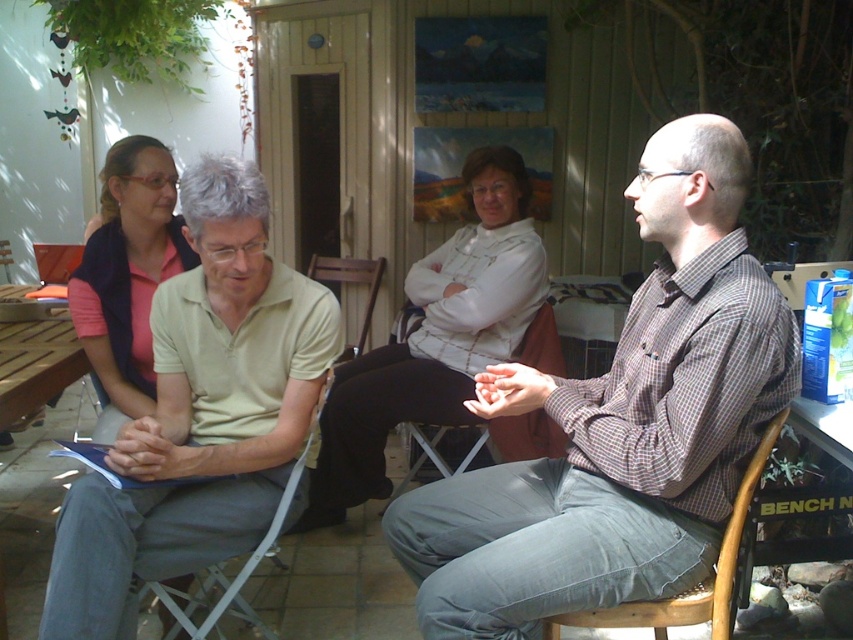
You are a photographer trying to capture a group photo of the two people at the center wearing the checkered fabric shirt at center and the light beige polo shirt at center. Since you want to ensure both are clearly visible, which shirt should you focus on first to avoid blurring due to size differences?

The checkered fabric shirt at center is bigger than the light beige polo shirt at center, so you should focus on the checkered fabric shirt at center first to ensure clarity and avoid blurring due to its larger size.

You are standing in front of the outdoor gathering scene. There are two points marked in the image. The first point is at coordinates point (630, 436) and the second is at point (137, 568). If you were to walk towards both points, which one would you reach first?

Point (630, 436) is closer to the viewer than point (137, 568), so you would reach point (630, 436) first.

You are a photographer trying to capture a candid shot of the two subjects wearing the light beige polo shirt at center and the wooden at right. The minimum focusing distance of your camera is 30 inches. Can you take the photo without moving either subject?

The light beige polo shirt at center and wooden at right are 33.04 inches apart, which is greater than the camera minimum focusing distance of 30 inches. Therefore, the photographer can take the photo without moving either subject.